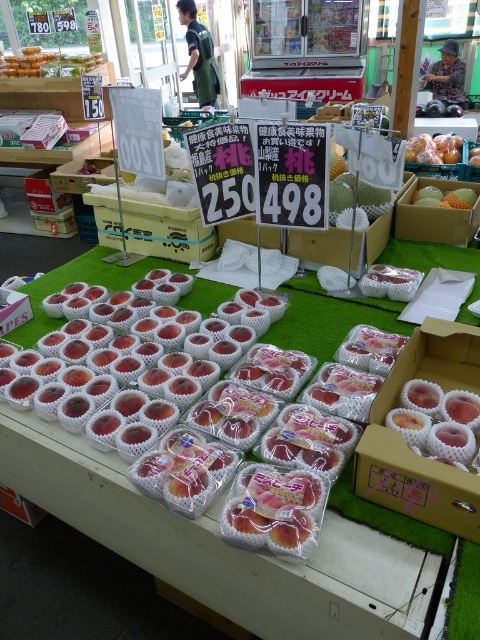
Question: Can you confirm if translucent plastic box at center is positioned to the left of yellow matte peach at center?

Choices:
 (A) no
 (B) yes

Answer: (B)

Question: Estimate the real-world distances between objects in this image. Which object is farther from the translucent plastic peaches at center?

Choices:
 (A) yellow matte peach at center
 (B) shiny black ball at center
 (C) translucent plastic box at center

Answer: (B)

Question: Is translucent plastic box at center positioned behind yellow matte peach at center?

Choices:
 (A) no
 (B) yes

Answer: (A)

Question: Is translucent plastic peaches at center further to the viewer compared to translucent plastic box at center?

Choices:
 (A) no
 (B) yes

Answer: (A)

Question: Estimate the real-world distances between objects in this image. Which object is closer to the yellow matte peach at center?

Choices:
 (A) translucent plastic box at center
 (B) shiny black ball at center
 (C) translucent plastic peaches at center

Answer: (A)

Question: Which of the following is the closest to the observer?

Choices:
 (A) shiny black ball at center
 (B) translucent plastic peaches at center

Answer: (B)